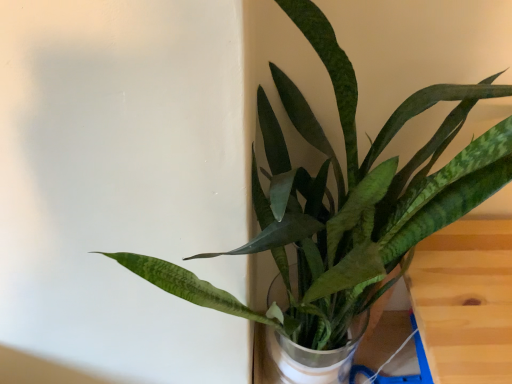
The height and width of the screenshot is (384, 512). What do you see at coordinates (465, 301) in the screenshot?
I see `wooden table at lower right` at bounding box center [465, 301].

You are a GUI agent. You are given a task and a screenshot of the screen. Output one action in this format:
    pyautogui.click(x=<x>, y=<y>)
    Task: Click on the wooden table at lower right
    This screenshot has width=512, height=384.
    Given the screenshot: What is the action you would take?
    pyautogui.click(x=465, y=301)

Measure the distance between point [420,303] and camera.

A distance of 84.00 centimeters exists between point [420,303] and camera.

Where is `wooden table at lower right`? This screenshot has width=512, height=384. wooden table at lower right is located at coordinates (465, 301).